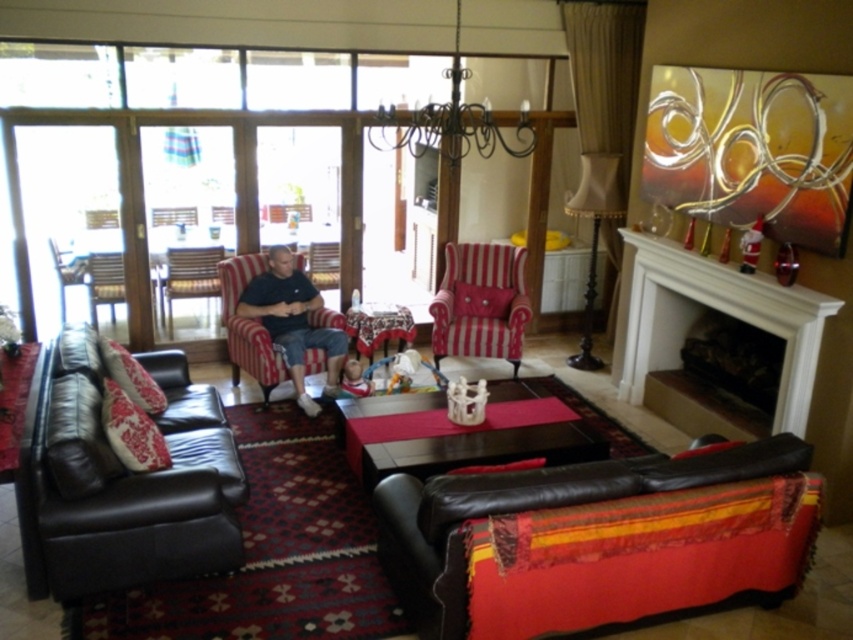
Can you confirm if black leather couch at lower left is positioned to the right of metallic silver chair at left?

Indeed, black leather couch at lower left is positioned on the right side of metallic silver chair at left.

Is black leather couch at lower left smaller than metallic silver chair at left?

Actually, black leather couch at lower left might be larger than metallic silver chair at left.

Is point (57, 561) positioned in front of point (80, 266)?

Yes.

I want to click on black leather couch at lower left, so click(125, 481).

Is leather couch at lower right positioned before striped fabric armchair at center?

Yes, leather couch at lower right is closer to the viewer.

Identify the location of leather couch at lower right. (590, 541).

Between black leather couch at lower left and dark wood coffee table at center, which one has less height?

dark wood coffee table at center is shorter.

What do you see at coordinates (125, 481) in the screenshot? I see `black leather couch at lower left` at bounding box center [125, 481].

Is point (57, 436) behind point (341, 433)?

No, (57, 436) is in front of (341, 433).

Where is `black leather couch at lower left`? Image resolution: width=853 pixels, height=640 pixels. black leather couch at lower left is located at coordinates (125, 481).